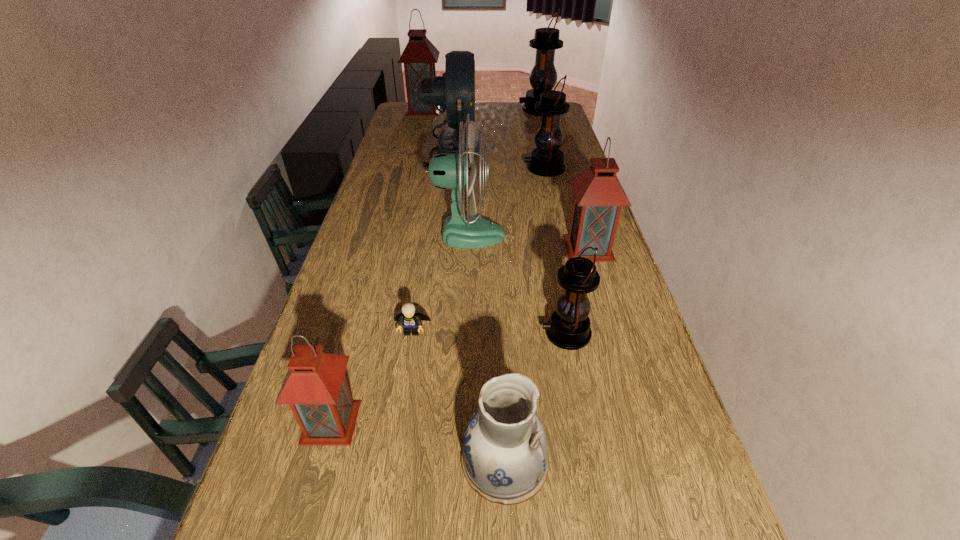
I want to click on free space located on the front-facing side of the Lego, so click(x=407, y=362).

Locate an element on the screen. fan that is at the left edge is located at coordinates (454, 91).

This screenshot has width=960, height=540. I want to click on object at the far left corner, so click(x=419, y=57).

Find the location of `object present at the far right corner`. object present at the far right corner is located at coordinates (543, 77).

Find the location of a particular element. The width and height of the screenshot is (960, 540). vacant space at the left edge of the desktop is located at coordinates (376, 223).

This screenshot has height=540, width=960. In order to click on vacant space at the right edge of the desktop in this screenshot , I will do `click(636, 299)`.

This screenshot has height=540, width=960. In the image, there is a desktop. In order to click on vacant space at the far left corner in this screenshot , I will do `click(397, 117)`.

The height and width of the screenshot is (540, 960). I want to click on vacant area between the nearest pink lantern and the Lego, so click(372, 376).

This screenshot has width=960, height=540. Find the location of `empty space between the biggest pink lantern and the biggest black lantern`. empty space between the biggest pink lantern and the biggest black lantern is located at coordinates (481, 109).

Identify the location of unoccupied position between the nearer fan and the nearest black lantern. (517, 284).